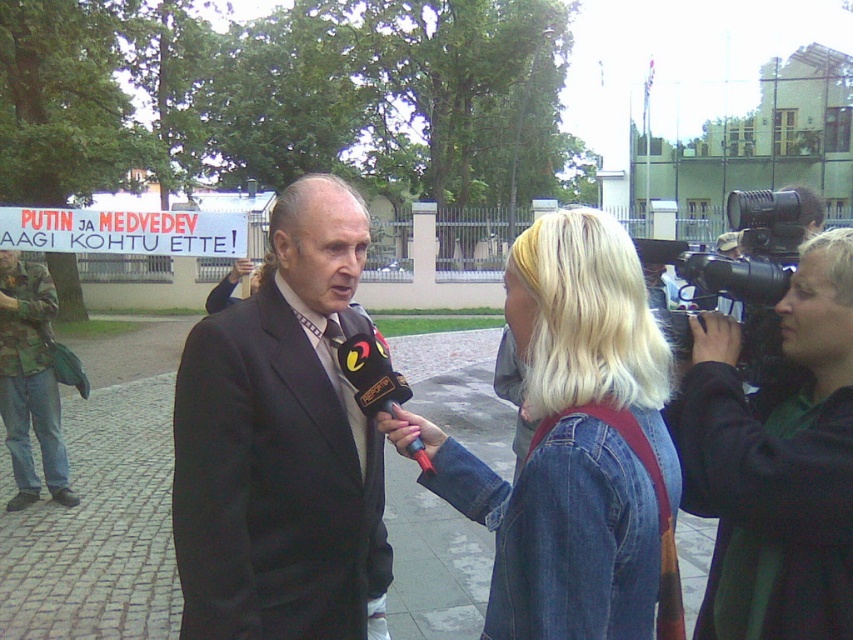
Between black suit at center and blonde hair at upper right, which one appears on the left side from the viewer's perspective?

black suit at center

Which is in front, point (318, 397) or point (717, 408)?

Point (717, 408) is in front.

Locate an element on the screen. The image size is (853, 640). black suit at center is located at coordinates (282, 444).

Is point (599, 432) less distant than point (57, 476)?

That is True.

Which of these two, denim jacket at center or camouflage fabric jacket at left, stands shorter?

Standing shorter between the two is denim jacket at center.

Find the location of `denim jacket at center`. denim jacket at center is located at coordinates (569, 442).

Between blonde hair at upper right and camouflage fabric jacket at left, which one appears on the left side from the viewer's perspective?

From the viewer's perspective, camouflage fabric jacket at left appears more on the left side.

Is blonde hair at upper right positioned behind camouflage fabric jacket at left?

That is False.

Does point (749, 515) come farther from viewer compared to point (53, 436)?

No, it is not.

Identify the location of blonde hair at upper right. (775, 461).